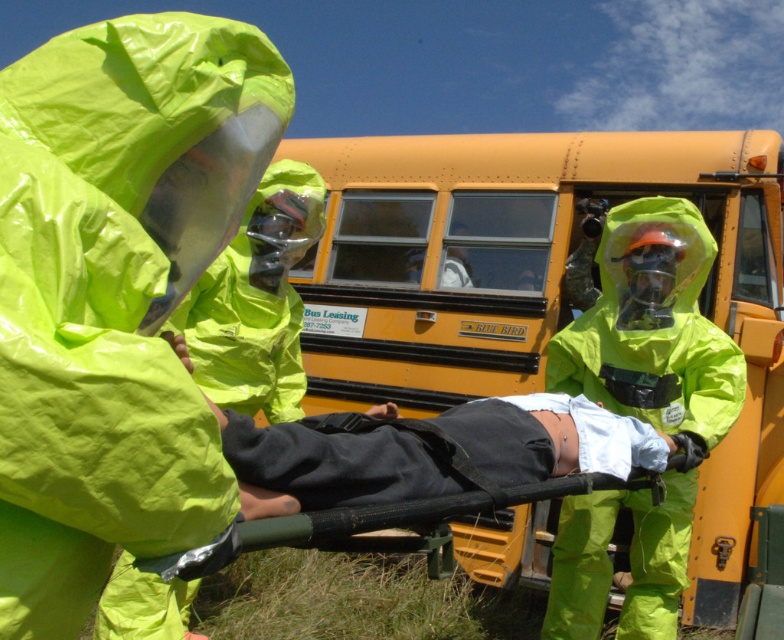
Is matte green hazmat suit at center below black fabric stretcher at center?

Yes.

Can you confirm if matte green hazmat suit at center is positioned to the right of black fabric stretcher at center?

Correct, you'll find matte green hazmat suit at center to the right of black fabric stretcher at center.

Which is behind, point (619, 216) or point (419, 512)?

Point (619, 216)

Identify the location of matte green hazmat suit at center. (648, 324).

In the scene shown: Is yellow matte school bus at center to the left of black matte stretcher at center from the viewer's perspective?

In fact, yellow matte school bus at center is to the right of black matte stretcher at center.

Can you confirm if yellow matte school bus at center is taller than black matte stretcher at center?

Correct, yellow matte school bus at center is much taller as black matte stretcher at center.

Between point (463, 552) and point (427, 470), which one is positioned behind?

Positioned behind is point (463, 552).

Image resolution: width=784 pixels, height=640 pixels. I want to click on yellow matte school bus at center, so click(539, 289).

Is black matte stretcher at center taller than black fabric stretcher at center?

Correct, black matte stretcher at center is much taller as black fabric stretcher at center.

Does black matte stretcher at center appear on the right side of black fabric stretcher at center?

In fact, black matte stretcher at center is to the left of black fabric stretcher at center.

Which is in front, point (557, 449) or point (438, 552)?

Point (438, 552) is more forward.

Locate an element on the screen. Image resolution: width=784 pixels, height=640 pixels. black matte stretcher at center is located at coordinates click(328, 465).